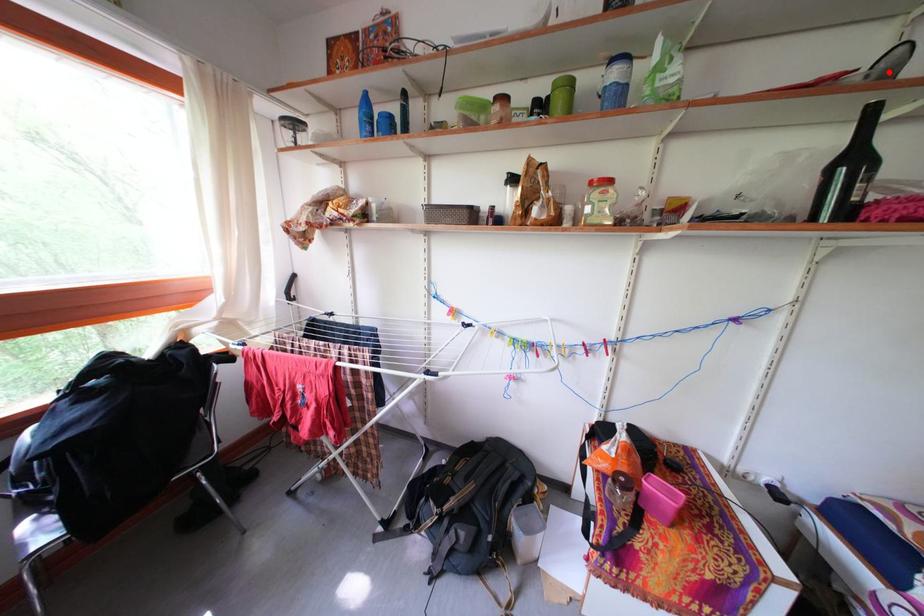
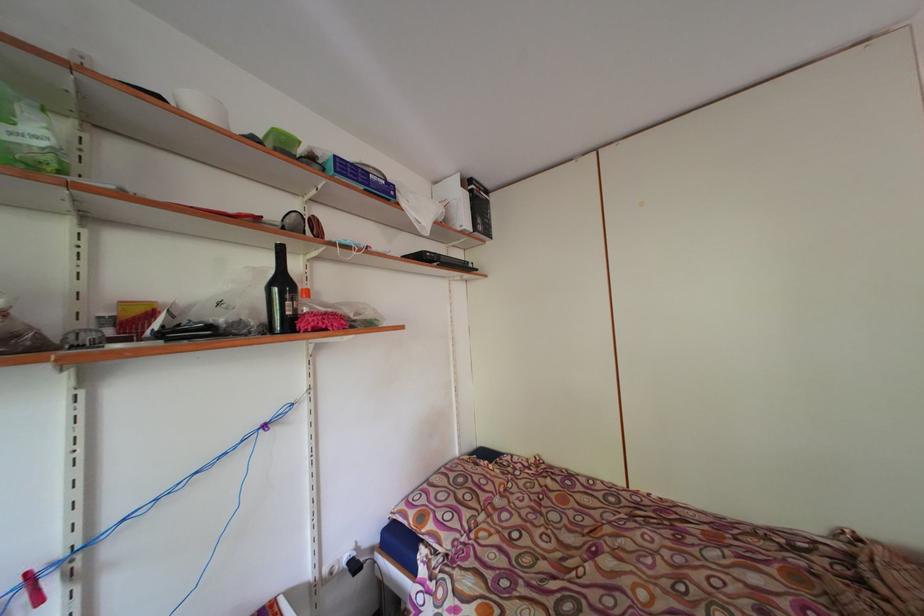
The point at the highlighted location is marked in the first image. Where is the corresponding point in the second image?

(296, 227)